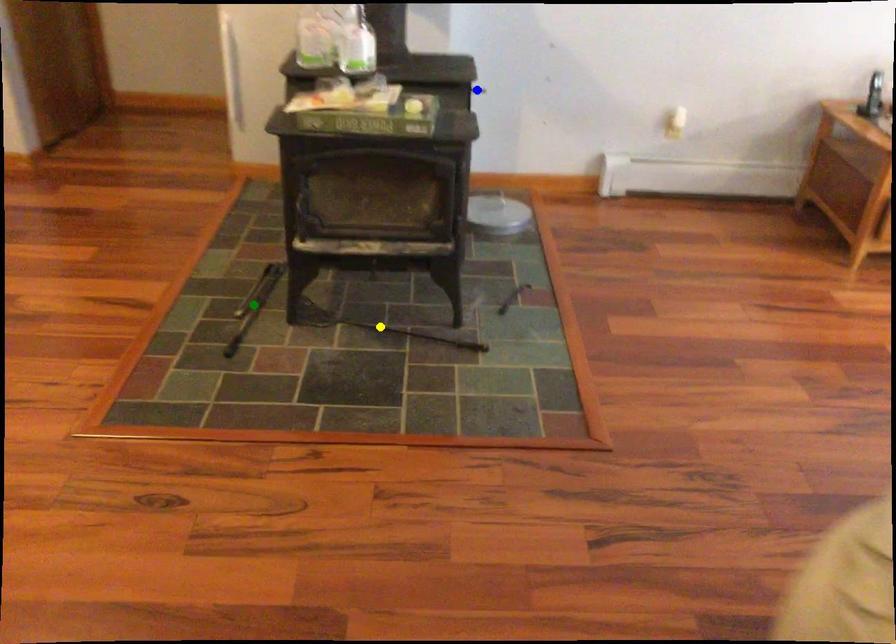
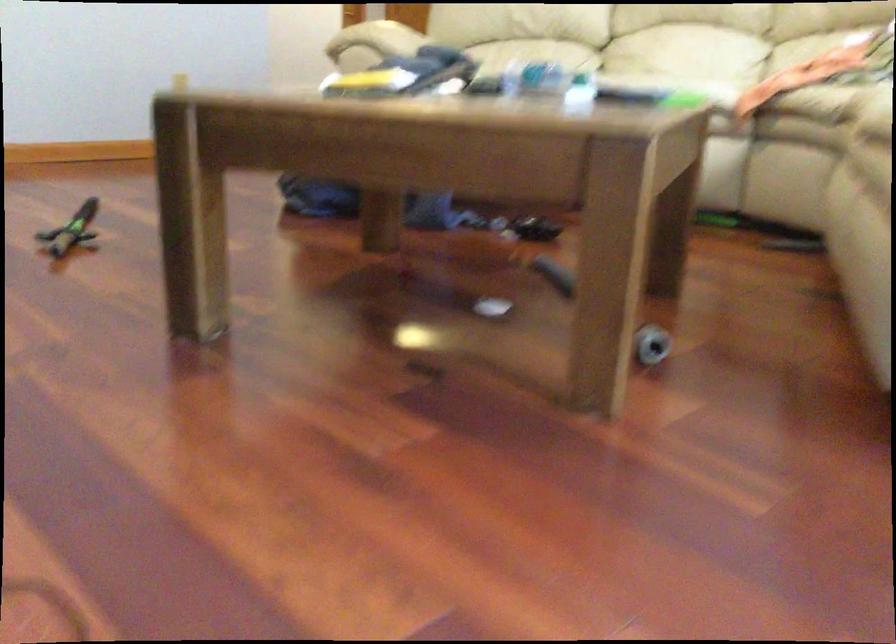
I am providing you with two images of the same scene from different viewpoints. Three points are marked in image1. Which point corresponds to a part or object that is occluded in image2?In image1, three points are marked. Which of them correspond to a part or object that is occluded in image2?Among the three points shown in image1, which one corresponds to a part or object that is no longer visible due to occlusion in image2?

Invisible in image2: green point, yellow point, blue point.